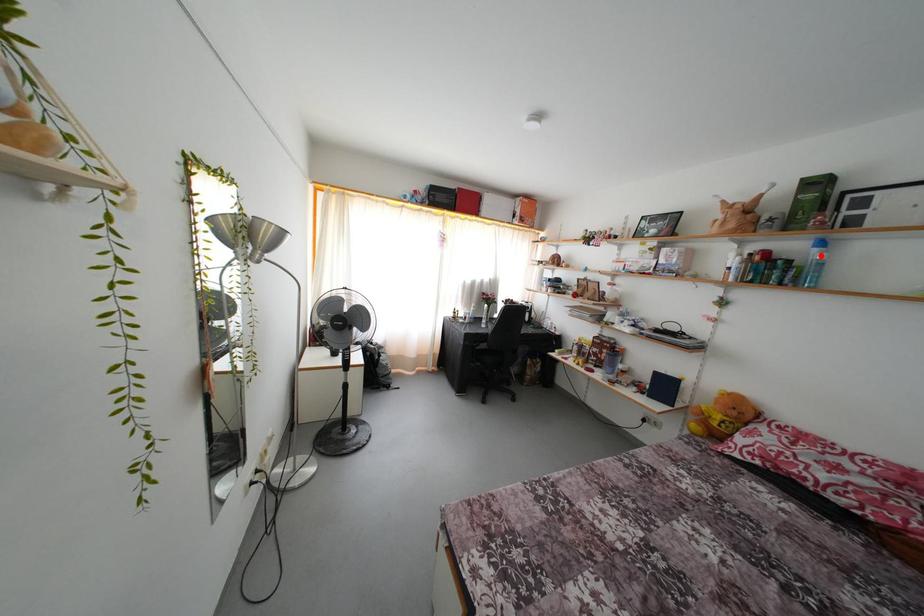
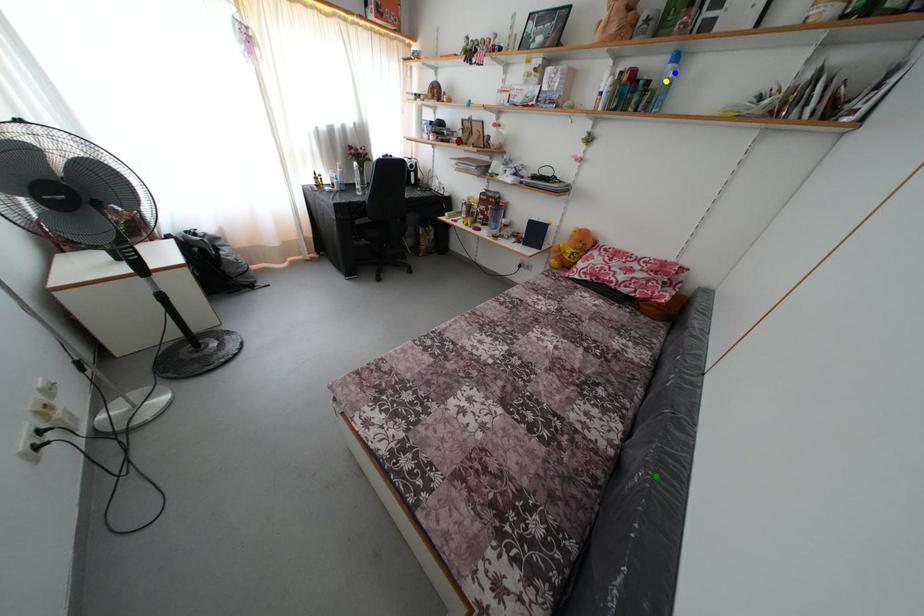
Question: I am providing you with two images of the same scene from different viewpoints. A red point is marked on the first image. You are given multiple points on the second image. Which spot in image 2 lines up with the point in image 1?

Choices:
 (A) yellow point
 (B) green point
 (C) blue point

Answer: (C)